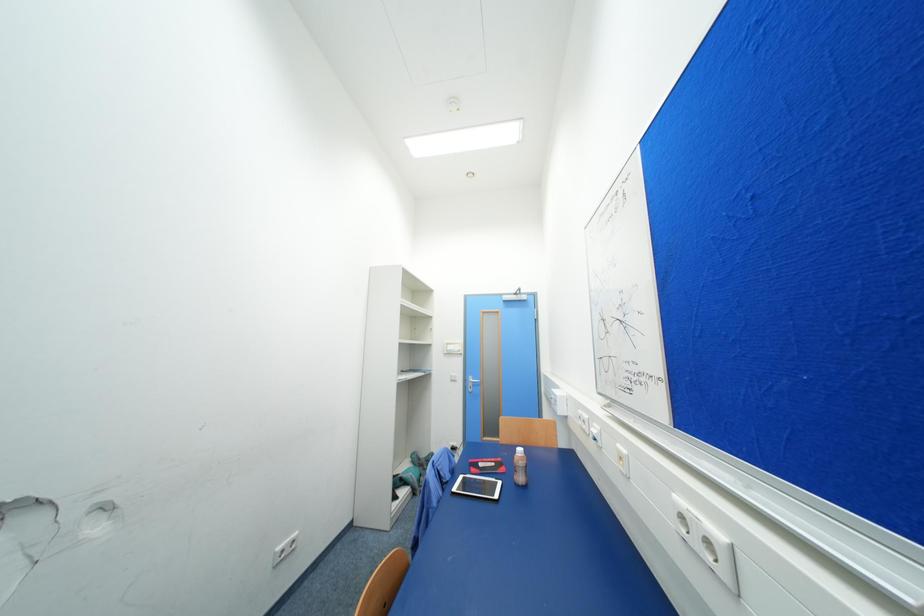
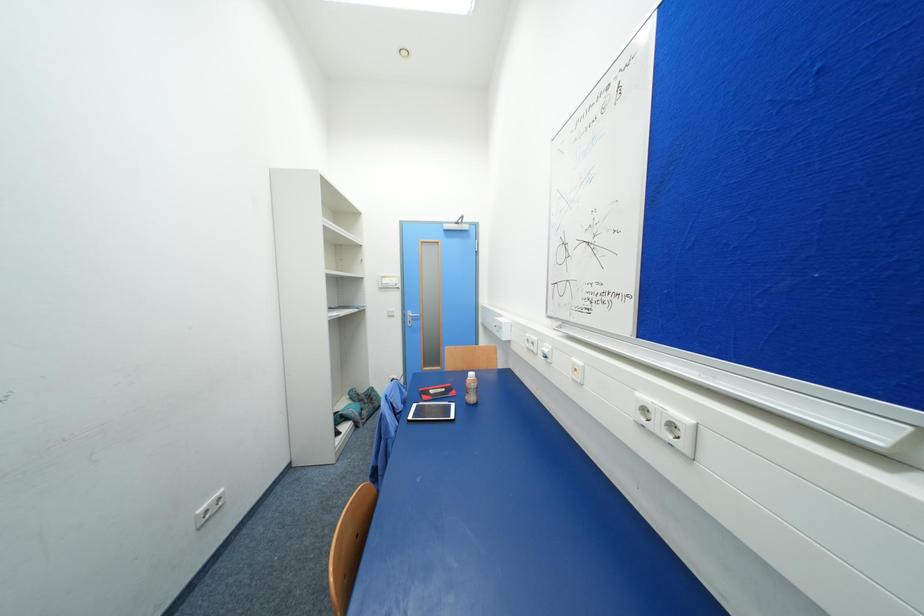
Question: The camera is either moving clockwise (left) or counter-clockwise (right) around the object. The first image is from the beginning of the video and the second image is from the end. Is the camera moving left or right when shooting the video?

Choices:
 (A) Left
 (B) Right

Answer: (A)